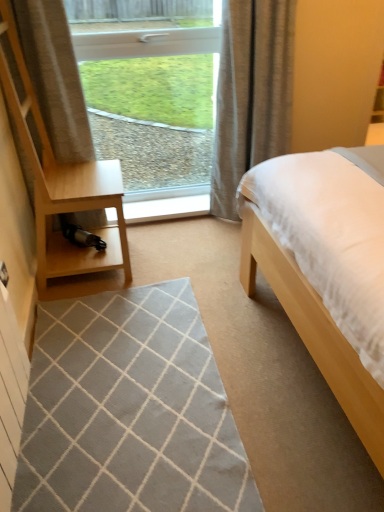
Find the location of `gray woven mat at center`. gray woven mat at center is located at coordinates (129, 410).

Describe the element at coordinates (150, 86) in the screenshot. The image size is (384, 512). I see `white plastic window at upper center` at that location.

This screenshot has width=384, height=512. Describe the element at coordinates (251, 93) in the screenshot. I see `gray textured curtain at upper right` at that location.

The image size is (384, 512). I want to click on gray woven mat at center, so click(x=129, y=410).

Is point (244, 73) positioned in front of point (138, 320)?

No.

In the scene shown: From a real-world perspective, which object rests below the other?

gray woven mat at center, from a real-world perspective.

Does gray textured curtain at upper right turn towards gray woven mat at center?

No, gray textured curtain at upper right does not turn towards gray woven mat at center.

Which of these two, gray textured curtain at upper right or gray woven mat at center, is thinner?

gray textured curtain at upper right.

Do you think white plastic window at upper center is within gray textured curtain at upper right, or outside of it?

white plastic window at upper center is not enclosed by gray textured curtain at upper right.

Between point (193, 12) and point (281, 52), which one is positioned in front?

The point (281, 52) is closer.

Is white plastic window at upper center looking in the opposite direction of gray textured curtain at upper right?

No, white plastic window at upper center is not facing the opposite direction of gray textured curtain at upper right.

Does white plastic window at upper center have a lesser width compared to gray textured curtain at upper right?

Indeed, white plastic window at upper center has a lesser width compared to gray textured curtain at upper right.

Which of these two, light wood/dark finish dresser at left or white plastic window at upper center, is bigger?

Bigger between the two is light wood/dark finish dresser at left.

Which is more to the right, light wood/dark finish dresser at left or white plastic window at upper center?

white plastic window at upper center is more to the right.

From a real-world perspective, is light wood/dark finish dresser at left positioned above or below white plastic window at upper center?

light wood/dark finish dresser at left is situated higher than white plastic window at upper center in the real world.

Is white plastic window at upper center a part of light wood/dark finish dresser at left?

Definitely not — white plastic window at upper center is not inside light wood/dark finish dresser at left.

From the image's perspective, is white plastic window at upper center below light wood/dark finish dresser at left?

Incorrect, from the image's perspective, white plastic window at upper center is higher than light wood/dark finish dresser at left.

Are white plastic window at upper center and light wood/dark finish dresser at left located far from each other?

Absolutely, white plastic window at upper center is distant from light wood/dark finish dresser at left.

From a real-world perspective, which object rests below the other?

From a 3D spatial view, white plastic window at upper center is below.

Is white plastic window at upper center facing away from light wood/dark finish dresser at left?

white plastic window at upper center does not have its back to light wood/dark finish dresser at left.

Is light wood/dark finish dresser at left looking in the opposite direction of gray textured curtain at upper right?

light wood/dark finish dresser at left does not have its back to gray textured curtain at upper right.

Measure the distance between light wood/dark finish dresser at left and gray textured curtain at upper right.

light wood/dark finish dresser at left is 31.79 inches away from gray textured curtain at upper right.

Which is more distant, (37, 211) or (257, 3)?

The point (257, 3) is farther from the camera.

From the image's perspective, who appears lower, light wood/dark finish dresser at left or gray textured curtain at upper right?

light wood/dark finish dresser at left, from the image's perspective.

I want to click on mat lying on the right of light wood/dark finish dresser at left, so click(x=129, y=410).

Is gray woven mat at center facing away from light wood/dark finish dresser at left?

No, light wood/dark finish dresser at left is not at the back of gray woven mat at center.

From a real-world perspective, is gray woven mat at center physically below light wood/dark finish dresser at left?

Yes, from a real-world perspective, gray woven mat at center is under light wood/dark finish dresser at left.

How much distance is there between gray woven mat at center and light wood/dark finish dresser at left?

A distance of 26.80 inches exists between gray woven mat at center and light wood/dark finish dresser at left.

From their relative heights in the image, would you say white plastic window at upper center is taller or shorter than gray woven mat at center?

white plastic window at upper center is taller than gray woven mat at center.

From the image's perspective, between white plastic window at upper center and gray woven mat at center, which one is located above?

white plastic window at upper center, from the image's perspective.

In order to click on window above the gray woven mat at center (from the image's perspective) in this screenshot , I will do `click(150, 86)`.

The image size is (384, 512). I want to click on curtain behind the gray woven mat at center, so click(251, 93).

Where is `curtain lying in front of the white plastic window at upper center`? curtain lying in front of the white plastic window at upper center is located at coordinates (251, 93).

Based on their spatial positions, is white plastic window at upper center or gray woven mat at center closer to gray textured curtain at upper right?

Based on the image, gray woven mat at center appears to be nearer to gray textured curtain at upper right.

Looking at the image, which one is located closer to light wood/dark finish dresser at left, white plastic window at upper center or gray textured curtain at upper right?

The object closer to light wood/dark finish dresser at left is gray textured curtain at upper right.

Based on their spatial positions, is gray woven mat at center or light wood/dark finish dresser at left closer to white plastic window at upper center?

Among the two, light wood/dark finish dresser at left is located nearer to white plastic window at upper center.

Considering their positions, is gray textured curtain at upper right positioned closer to gray woven mat at center than light wood/dark finish dresser at left?

Based on the image, light wood/dark finish dresser at left appears to be nearer to gray woven mat at center.

Looking at the image, which one is located closer to white plastic window at upper center, gray woven mat at center or gray textured curtain at upper right?

gray textured curtain at upper right is positioned closer to the anchor white plastic window at upper center.

In the scene shown: Considering their positions, is gray textured curtain at upper right positioned closer to gray woven mat at center than white plastic window at upper center?

gray textured curtain at upper right lies closer to gray woven mat at center than the other object.

From the image, which object appears to be farther from white plastic window at upper center, gray textured curtain at upper right or gray woven mat at center?

Based on the image, gray woven mat at center appears to be further to white plastic window at upper center.

Considering their positions, is gray woven mat at center positioned closer to gray textured curtain at upper right than white plastic window at upper center?

Among the two, gray woven mat at center is located nearer to gray textured curtain at upper right.

Identify the location of curtain between white plastic window at upper center and gray woven mat at center vertically. The height and width of the screenshot is (512, 384). (251, 93).

Find the location of a particular element. dresser between gray textured curtain at upper right and gray woven mat at center in the vertical direction is located at coordinates (62, 183).

Where is `window between light wood/dark finish dresser at left and gray textured curtain at upper right from left to right`? The image size is (384, 512). window between light wood/dark finish dresser at left and gray textured curtain at upper right from left to right is located at coordinates (150, 86).

Image resolution: width=384 pixels, height=512 pixels. What are the coordinates of `dresser between white plastic window at upper center and gray woven mat at center vertically` in the screenshot? It's located at (62, 183).